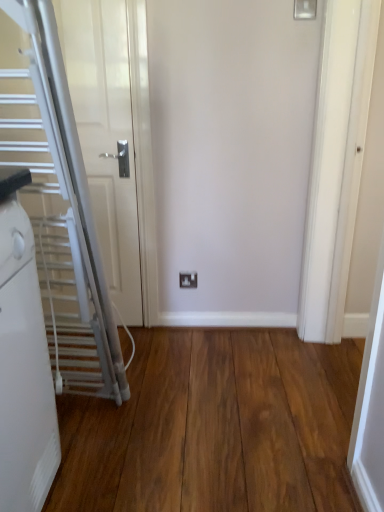
Find the location of a particular element. The width and height of the screenshot is (384, 512). white plastic electric outlet at center is located at coordinates (188, 280).

The height and width of the screenshot is (512, 384). What do you see at coordinates (188, 280) in the screenshot?
I see `white plastic electric outlet at center` at bounding box center [188, 280].

Identify the location of wooden floor at center. Image resolution: width=384 pixels, height=512 pixels. (215, 426).

Can you confirm if white plastic electric outlet at center is taller than wooden floor at center?

Indeed, white plastic electric outlet at center has a greater height compared to wooden floor at center.

Is point (194, 279) positioned behind point (170, 492)?

Yes, point (194, 279) is behind point (170, 492).

Is wooden floor at center a part of white plastic electric outlet at center?

That's incorrect, wooden floor at center is not inside white plastic electric outlet at center.

Between white plastic electric outlet at center and wooden floor at center, which one appears on the left side from the viewer's perspective?

From the viewer's perspective, wooden floor at center appears more on the left side.

Is point (63, 282) farther from viewer compared to point (194, 279)?

No, it is not.

From the image's perspective, does silver metallic escalator at left appear higher than white plastic electric outlet at center?

Indeed, from the image's perspective, silver metallic escalator at left is shown above white plastic electric outlet at center.

Does silver metallic escalator at left contain white plastic electric outlet at center?

No, white plastic electric outlet at center is not a part of silver metallic escalator at left.

From a real-world perspective, which object rests below the other?

From a 3D spatial view, wooden floor at center is below.

Is wooden floor at center positioned behind silver metallic escalator at left?

That is False.

Is wooden floor at center to the left of silver metallic escalator at left from the viewer's perspective?

In fact, wooden floor at center is to the right of silver metallic escalator at left.

Does wooden floor at center have a lesser width compared to silver metallic escalator at left?

No, wooden floor at center is not thinner than silver metallic escalator at left.

Which of these two, wooden floor at center or white plastic electric outlet at center, is wider?

wooden floor at center.

How different are the orientations of wooden floor at center and white plastic electric outlet at center in degrees?

89.5 degrees.

Is wooden floor at center to the left or to the right of white plastic electric outlet at center in the image?

In the image, wooden floor at center appears on the left side of white plastic electric outlet at center.

From the image's perspective, is wooden floor at center above white plastic electric outlet at center?

Actually, wooden floor at center appears below white plastic electric outlet at center in the image.

From a real-world perspective, is silver metallic escalator at left physically located above or below wooden floor at center?

silver metallic escalator at left is situated higher than wooden floor at center in the real world.

Who is bigger, silver metallic escalator at left or wooden floor at center?

silver metallic escalator at left.

From the image's perspective, which one is positioned lower, silver metallic escalator at left or wooden floor at center?

wooden floor at center is shown below in the image.

Can you confirm if silver metallic escalator at left is positioned to the left of wooden floor at center?

Indeed, silver metallic escalator at left is positioned on the left side of wooden floor at center.

Where is `escalator located above the white plastic electric outlet at center (from a real-world perspective)`? Image resolution: width=384 pixels, height=512 pixels. escalator located above the white plastic electric outlet at center (from a real-world perspective) is located at coordinates (59, 209).

Which of these two, white plastic electric outlet at center or silver metallic escalator at left, is bigger?

silver metallic escalator at left.

From the image's perspective, is white plastic electric outlet at center located above or below silver metallic escalator at left?

Based on their image positions, white plastic electric outlet at center is located beneath silver metallic escalator at left.

Where is `corridor located on the left of white plastic electric outlet at center`? corridor located on the left of white plastic electric outlet at center is located at coordinates (215, 426).

Locate an element on the screen. Image resolution: width=384 pixels, height=512 pixels. electric outlet below the silver metallic escalator at left (from a real-world perspective) is located at coordinates (188, 280).

From the image, which object appears to be farther from silver metallic escalator at left, wooden floor at center or white plastic electric outlet at center?

The object further to silver metallic escalator at left is white plastic electric outlet at center.

Considering their positions, is silver metallic escalator at left positioned closer to white plastic electric outlet at center than wooden floor at center?

Based on the image, wooden floor at center appears to be nearer to white plastic electric outlet at center.

From the image, which object appears to be farther from silver metallic escalator at left, white plastic electric outlet at center or wooden floor at center?

white plastic electric outlet at center is positioned further to the anchor silver metallic escalator at left.

Which object lies further to the anchor point wooden floor at center, white plastic electric outlet at center or silver metallic escalator at left?

Based on the image, white plastic electric outlet at center appears to be further to wooden floor at center.

Looking at the image, which one is located closer to wooden floor at center, silver metallic escalator at left or white plastic electric outlet at center?

silver metallic escalator at left lies closer to wooden floor at center than the other object.

Considering their positions, is wooden floor at center positioned further to white plastic electric outlet at center than silver metallic escalator at left?

Based on the image, silver metallic escalator at left appears to be further to white plastic electric outlet at center.

Locate an element on the screen. The height and width of the screenshot is (512, 384). electric outlet that lies between silver metallic escalator at left and wooden floor at center from top to bottom is located at coordinates (188, 280).